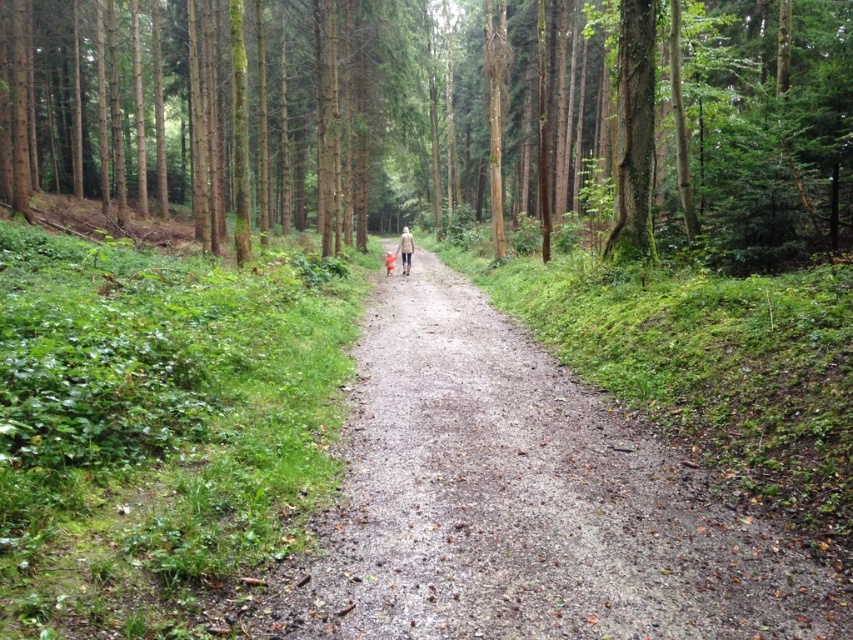
Is green mossy tree at center wider than light brown leather jacket at center?

Yes, green mossy tree at center is wider than light brown leather jacket at center.

Does green mossy tree at center have a lesser height compared to light brown leather jacket at center?

Incorrect, green mossy tree at center's height does not fall short of light brown leather jacket at center's.

Does point (450, 211) come behind point (408, 256)?

Yes, point (450, 211) is behind point (408, 256).

Find the location of a particular element. This screenshot has width=853, height=640. green mossy tree at center is located at coordinates (448, 116).

Is green mossy tree at center positioned at the back of orange fabric child at center?

No, green mossy tree at center is closer to the viewer.

Does green mossy tree at center come in front of orange fabric child at center?

That is True.

Is point (120, 113) closer to viewer compared to point (387, 260)?

No, it is behind (387, 260).

This screenshot has height=640, width=853. Find the location of `green mossy tree at center`. green mossy tree at center is located at coordinates (448, 116).

Where is `light brown leather jacket at center`? The image size is (853, 640). light brown leather jacket at center is located at coordinates (405, 250).

Can you confirm if light brown leather jacket at center is shorter than orange fabric child at center?

In fact, light brown leather jacket at center may be taller than orange fabric child at center.

The height and width of the screenshot is (640, 853). I want to click on light brown leather jacket at center, so click(405, 250).